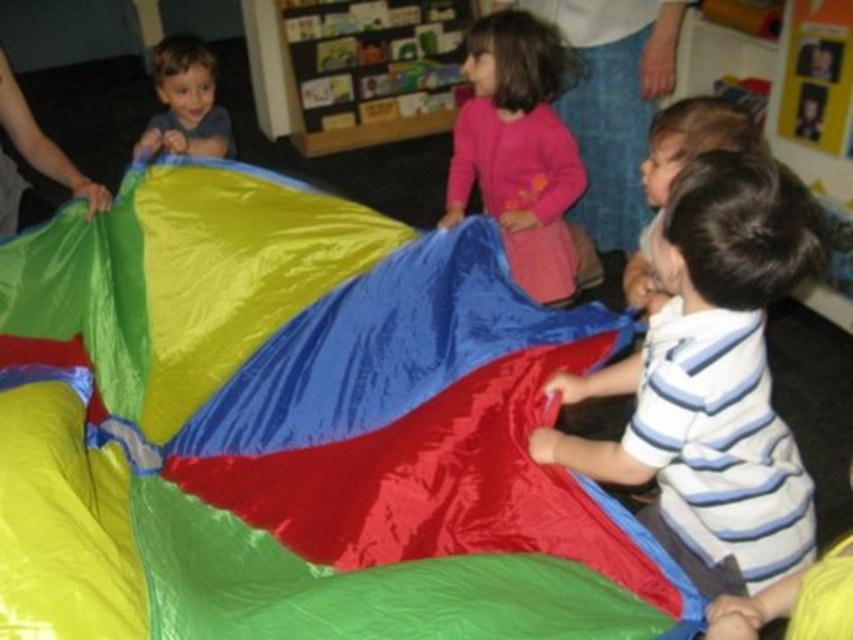
Between striped cotton shirt at lower right and matte blue shirt at upper left, which one is positioned higher?

Positioned higher is matte blue shirt at upper left.

I want to click on striped cotton shirt at lower right, so click(x=712, y=378).

From the picture: Can you confirm if pink fabric at center is smaller than matte blue shirt at upper left?

No.

Is point (476, 109) closer to viewer compared to point (157, 72)?

Yes, it is.

What do you see at coordinates (518, 148) in the screenshot? Image resolution: width=853 pixels, height=640 pixels. I see `pink fabric at center` at bounding box center [518, 148].

Identify the location of pink fabric at center. (518, 148).

Consider the image. Does shiny plastic kite at center appear on the left side of matte blue shirt at upper left?

Incorrect, shiny plastic kite at center is not on the left side of matte blue shirt at upper left.

Can you confirm if shiny plastic kite at center is taller than matte blue shirt at upper left?

Yes, shiny plastic kite at center is taller than matte blue shirt at upper left.

Is point (384, 516) behind point (170, 67)?

No, it is in front of (170, 67).

Locate an element on the screen. This screenshot has height=640, width=853. shiny plastic kite at center is located at coordinates (294, 428).